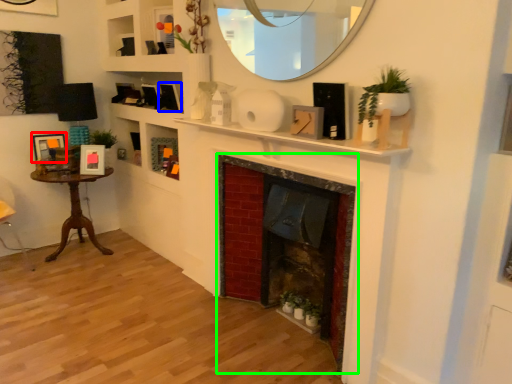
Question: Which is farther away from picture frame (highlighted by a red box)? picture frame (highlighted by a blue box) or fireplace (highlighted by a green box)?

Choices:
 (A) picture frame
 (B) fireplace

Answer: (B)